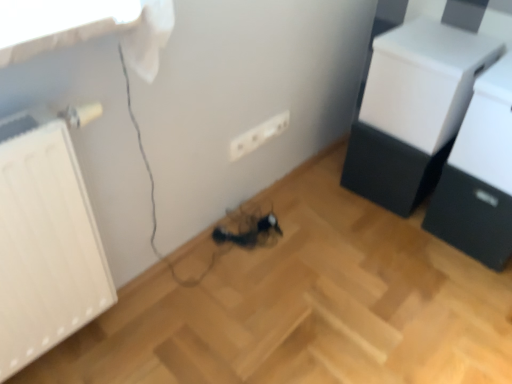
This screenshot has height=384, width=512. I want to click on white glossy printer at upper right, which appears as the 1th furniture when viewed from the right, so click(479, 175).

Where is `white matte drawer at upper right, the second furniture from the right`? white matte drawer at upper right, the second furniture from the right is located at coordinates (412, 110).

What do you see at coordinates (412, 110) in the screenshot? I see `white matte drawer at upper right, arranged as the first furniture when viewed from the left` at bounding box center [412, 110].

Find the location of a particular element. This screenshot has height=384, width=512. white matte radiator at left is located at coordinates (45, 243).

Consider the image. Measure the distance between white matte radiator at left and camera.

white matte radiator at left is 74.50 centimeters away from camera.

Where is `white glossy printer at upper right, which appears as the 1th furniture when viewed from the right`? The height and width of the screenshot is (384, 512). white glossy printer at upper right, which appears as the 1th furniture when viewed from the right is located at coordinates (479, 175).

Can you confirm if black matte drawer at lower right is positioned to the right of white glossy printer at upper right, placed as the 2th furniture when sorted from left to right?

Indeed, black matte drawer at lower right is positioned on the right side of white glossy printer at upper right, placed as the 2th furniture when sorted from left to right.

Who is more distant, black matte drawer at lower right or white glossy printer at upper right, which appears as the 1th furniture when viewed from the right?

black matte drawer at lower right is further from the camera.

From a real-world perspective, is black matte drawer at lower right over white glossy printer at upper right, which appears as the 1th furniture when viewed from the right?

Actually, black matte drawer at lower right is physically below white glossy printer at upper right, which appears as the 1th furniture when viewed from the right, in the real world.

In the image, is white matte radiator at left positioned in front of or behind white plastic electric outlet at center?

Visually, white matte radiator at left is located in front of white plastic electric outlet at center.

Is white matte radiator at left placed right next to white plastic electric outlet at center?

No.

In the scene shown: Can you confirm if white matte radiator at left is bigger than white plastic electric outlet at center?

Yes.

Is white matte radiator at left oriented away from white plastic electric outlet at center?

That's not correct — white matte radiator at left is not looking away from white plastic electric outlet at center.

What's the angular difference between white plastic electric outlet at center and black matte drawer at lower right's facing directions?

The angle between the facing direction of white plastic electric outlet at center and the facing direction of black matte drawer at lower right is 90 degrees.

Is white plastic electric outlet at center positioned far away from black matte drawer at lower right?

white plastic electric outlet at center is actually quite close to black matte drawer at lower right.

Between point (287, 126) and point (461, 217), which one is positioned behind?

The point (287, 126) is farther from the camera.

Between white plastic electric outlet at center and black matte drawer at lower right, which one appears on the left side from the viewer's perspective?

white plastic electric outlet at center.

Looking at this image, is there a large distance between white plastic electric outlet at center and white glossy printer at upper right, which appears as the 1th furniture when viewed from the right?

white plastic electric outlet at center is near white glossy printer at upper right, which appears as the 1th furniture when viewed from the right, not far away.

How many degrees apart are the facing directions of white plastic electric outlet at center and white glossy printer at upper right, placed as the 2th furniture when sorted from left to right?

The angular difference between white plastic electric outlet at center and white glossy printer at upper right, placed as the 2th furniture when sorted from left to right, is 90 degrees.

From the image's perspective, which is below, white plastic electric outlet at center or white glossy printer at upper right, which appears as the 1th furniture when viewed from the right?

From the image's view, white plastic electric outlet at center is below.

Does white plastic electric outlet at center have a larger size compared to white glossy printer at upper right, which appears as the 1th furniture when viewed from the right?

No.

The image size is (512, 384). I want to click on electric outlet behind the white matte drawer at upper right, arranged as the first furniture when viewed from the left, so click(x=258, y=135).

Which is in front, white plastic electric outlet at center or white matte drawer at upper right, arranged as the first furniture when viewed from the left?

white matte drawer at upper right, arranged as the first furniture when viewed from the left, is closer to the camera.

From the image's perspective, which is below, white plastic electric outlet at center or white matte drawer at upper right, arranged as the first furniture when viewed from the left?

white plastic electric outlet at center, from the image's perspective.

Considering the sizes of white plastic electric outlet at center and white matte radiator at left in the image, is white plastic electric outlet at center wider or thinner than white matte radiator at left?

Considering their sizes, white plastic electric outlet at center looks slimmer than white matte radiator at left.

How many degrees apart are the facing directions of white plastic electric outlet at center and white matte radiator at left?

The angle between the facing direction of white plastic electric outlet at center and the facing direction of white matte radiator at left is 0.682 degrees.

Can you confirm if white plastic electric outlet at center is smaller than white matte radiator at left?

Correct, white plastic electric outlet at center occupies less space than white matte radiator at left.

Is white matte radiator at left at the back of white plastic electric outlet at center?

That's not correct — white plastic electric outlet at center is not looking away from white matte radiator at left.

Considering the positions of points (474, 36) and (7, 216), is point (474, 36) farther from camera compared to point (7, 216)?

That is True.

Is white matte drawer at upper right, arranged as the first furniture when viewed from the left, facing towards white matte radiator at left?

Yes, white matte drawer at upper right, arranged as the first furniture when viewed from the left, is turned towards white matte radiator at left.

How different are the orientations of white matte drawer at upper right, arranged as the first furniture when viewed from the left, and white matte radiator at left in degrees?

The angle between the facing direction of white matte drawer at upper right, arranged as the first furniture when viewed from the left, and the facing direction of white matte radiator at left is 90.7 degrees.

Is the position of white matte drawer at upper right, arranged as the first furniture when viewed from the left, more distant than that of white matte radiator at left?

Yes, white matte drawer at upper right, arranged as the first furniture when viewed from the left, is behind white matte radiator at left.

At what (x,y) coordinates should I click in order to perform the action: click on drawer on the right of white glossy printer at upper right, which appears as the 1th furniture when viewed from the right. Please return your answer as a coordinate pair (x, y). The image size is (512, 384). Looking at the image, I should click on (471, 217).

You are a GUI agent. You are given a task and a screenshot of the screen. Output one action in this format:
    pyautogui.click(x=<x>, y=<y>)
    Task: Click on the radiator on the left of white plastic electric outlet at center
    The image size is (512, 384).
    Given the screenshot: What is the action you would take?
    pyautogui.click(x=45, y=243)

Based on the photo, estimate the real-world distances between objects in this image. Which object is further from white plastic electric outlet at center, white glossy printer at upper right, placed as the 2th furniture when sorted from left to right, or white matte radiator at left?

Based on the image, white matte radiator at left appears to be further to white plastic electric outlet at center.

Estimate the real-world distances between objects in this image. Which object is further from black matte drawer at lower right, white matte drawer at upper right, the second furniture from the right, or white plastic electric outlet at center?

white plastic electric outlet at center is positioned further to the anchor black matte drawer at lower right.

Estimate the real-world distances between objects in this image. Which object is further from white glossy printer at upper right, placed as the 2th furniture when sorted from left to right, white matte drawer at upper right, the second furniture from the right, or white matte radiator at left?

Among the two, white matte radiator at left is located further to white glossy printer at upper right, placed as the 2th furniture when sorted from left to right.

When comparing their distances from white glossy printer at upper right, which appears as the 1th furniture when viewed from the right, does white plastic electric outlet at center or black matte drawer at lower right seem further?

Based on the image, white plastic electric outlet at center appears to be further to white glossy printer at upper right, which appears as the 1th furniture when viewed from the right.

From the image, which object appears to be farther from white matte radiator at left, white matte drawer at upper right, the second furniture from the right, or black matte drawer at lower right?

black matte drawer at lower right is further to white matte radiator at left.

From the image, which object appears to be farther from white glossy printer at upper right, which appears as the 1th furniture when viewed from the right, white matte drawer at upper right, arranged as the first furniture when viewed from the left, or white plastic electric outlet at center?

white plastic electric outlet at center is positioned further to the anchor white glossy printer at upper right, which appears as the 1th furniture when viewed from the right.

When comparing their distances from white matte drawer at upper right, the second furniture from the right, does black matte drawer at lower right or white plastic electric outlet at center seem further?

white plastic electric outlet at center lies further to white matte drawer at upper right, the second furniture from the right, than the other object.

Considering their positions, is white plastic electric outlet at center positioned closer to white matte drawer at upper right, the second furniture from the right, than white matte radiator at left?

white plastic electric outlet at center is closer to white matte drawer at upper right, the second furniture from the right.

Locate an element on the screen. Image resolution: width=512 pixels, height=384 pixels. electric outlet located between white matte radiator at left and white glossy printer at upper right, placed as the 2th furniture when sorted from left to right, in the left-right direction is located at coordinates (258, 135).

Where is `furniture between white matte drawer at upper right, arranged as the first furniture when viewed from the left, and black matte drawer at lower right vertically`? furniture between white matte drawer at upper right, arranged as the first furniture when viewed from the left, and black matte drawer at lower right vertically is located at coordinates (479, 175).

The height and width of the screenshot is (384, 512). What are the coordinates of `furniture located between white plastic electric outlet at center and white glossy printer at upper right, which appears as the 1th furniture when viewed from the right, in the left-right direction` in the screenshot? It's located at (412, 110).

Where is `electric outlet between white matte radiator at left and white matte drawer at upper right, the second furniture from the right`? Image resolution: width=512 pixels, height=384 pixels. electric outlet between white matte radiator at left and white matte drawer at upper right, the second furniture from the right is located at coordinates (258, 135).